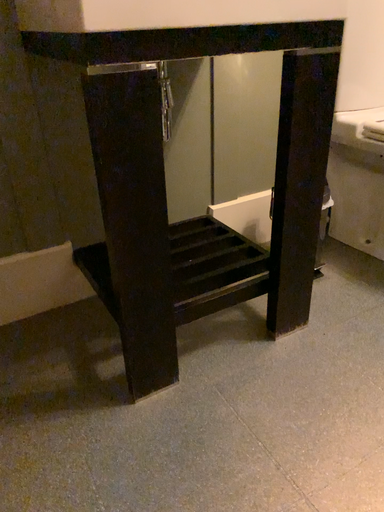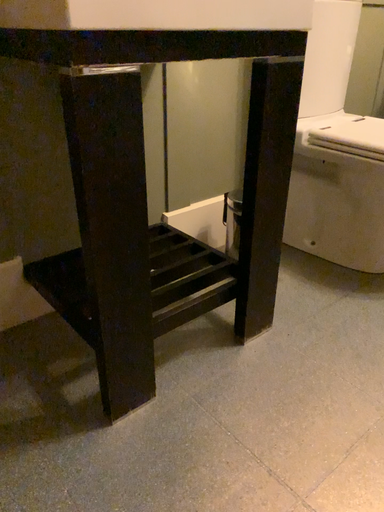
Question: How did the camera likely rotate when shooting the video?

Choices:
 (A) rotated right
 (B) rotated left

Answer: (A)